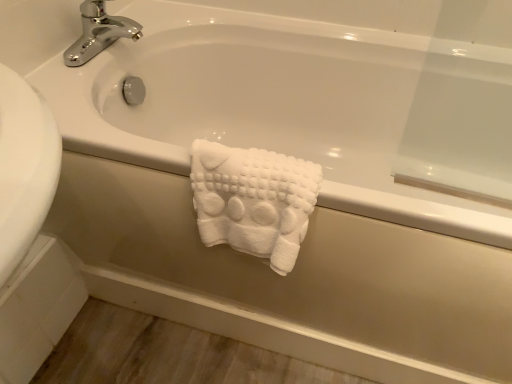
Question: Is white fluffy towel at center taller or shorter than chrome/metallic faucet at upper left?

Choices:
 (A) short
 (B) tall

Answer: (B)

Question: Looking at the image, does white fluffy towel at center seem bigger or smaller compared to chrome/metallic faucet at upper left?

Choices:
 (A) big
 (B) small

Answer: (A)

Question: Do you think white fluffy towel at center is within chrome/metallic faucet at upper left, or outside of it?

Choices:
 (A) outside
 (B) inside

Answer: (A)

Question: From the image's perspective, relative to white fluffy towel at center, is chrome/metallic faucet at upper left above or below?

Choices:
 (A) above
 (B) below

Answer: (A)

Question: From a real-world perspective, is chrome/metallic faucet at upper left above or below white fluffy towel at center?

Choices:
 (A) above
 (B) below

Answer: (A)

Question: Considering the relative positions of chrome/metallic faucet at upper left and white fluffy towel at center in the image provided, is chrome/metallic faucet at upper left to the left or to the right of white fluffy towel at center?

Choices:
 (A) right
 (B) left

Answer: (B)

Question: Is chrome/metallic faucet at upper left bigger or smaller than white fluffy towel at center?

Choices:
 (A) big
 (B) small

Answer: (B)